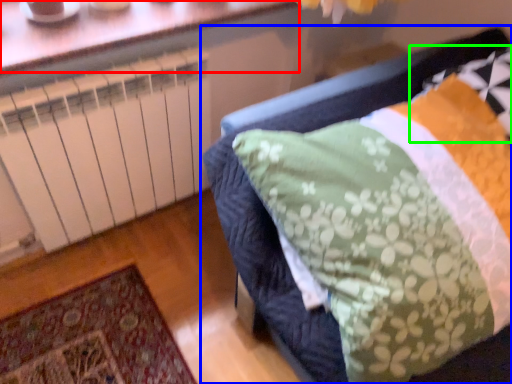
Question: Considering the real-world distances, which object is closest to window (highlighted by a red box)? furniture (highlighted by a blue box) or pillow (highlighted by a green box).

Choices:
 (A) furniture
 (B) pillow

Answer: (A)